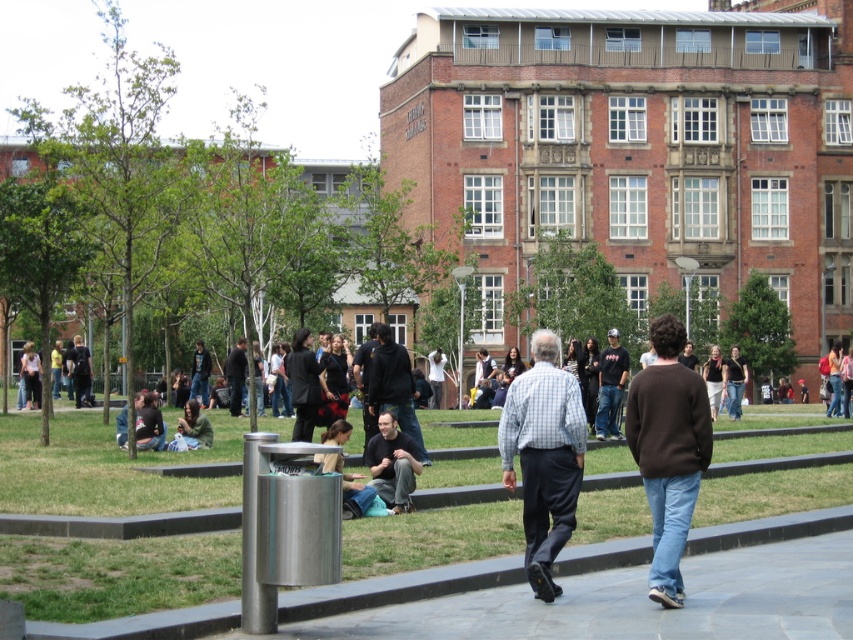
You are a photographer standing at the edge of the walkway in the public square. You notice two people wearing a light blue checkered shirt at center and a dark blue shirt at center. Which person should you focus on to capture a taller subject in your photo?

The light blue checkered shirt at center has a greater height compared to the dark blue shirt at center, so you should focus on the person wearing the light blue checkered shirt at center to capture a taller subject.

You are standing at the point labeled point at (397,380). You want to reach the entrance of the building which is 165.45 feet away. If you can walk 3 feet per second, how many seconds will it take you to reach the entrance?

The distance between the point at (397,380) and the entrance is 165.45 feet. At a walking speed of 3 feet per second, it will take 165.45 divided by 3, which equals approximately 55.15 seconds to reach the entrance.